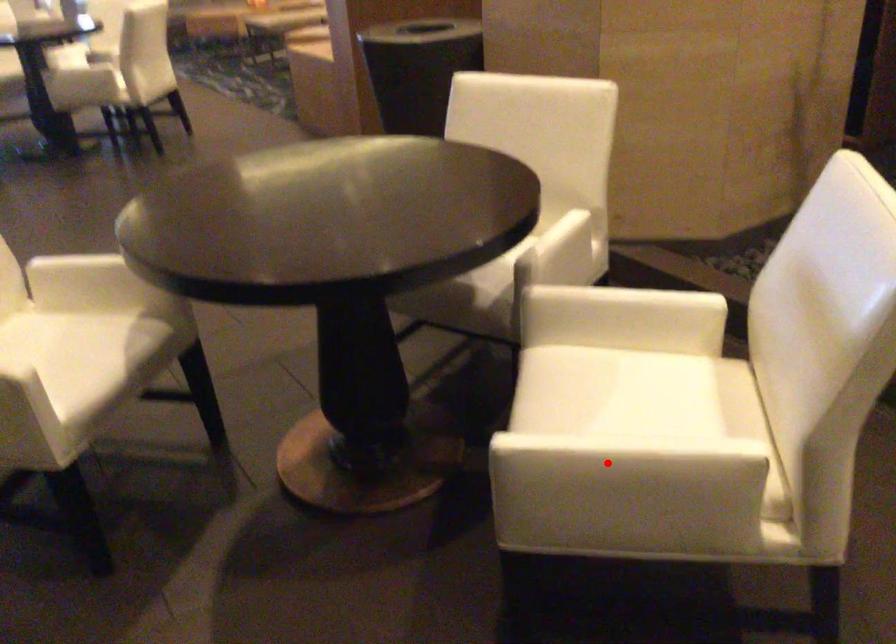
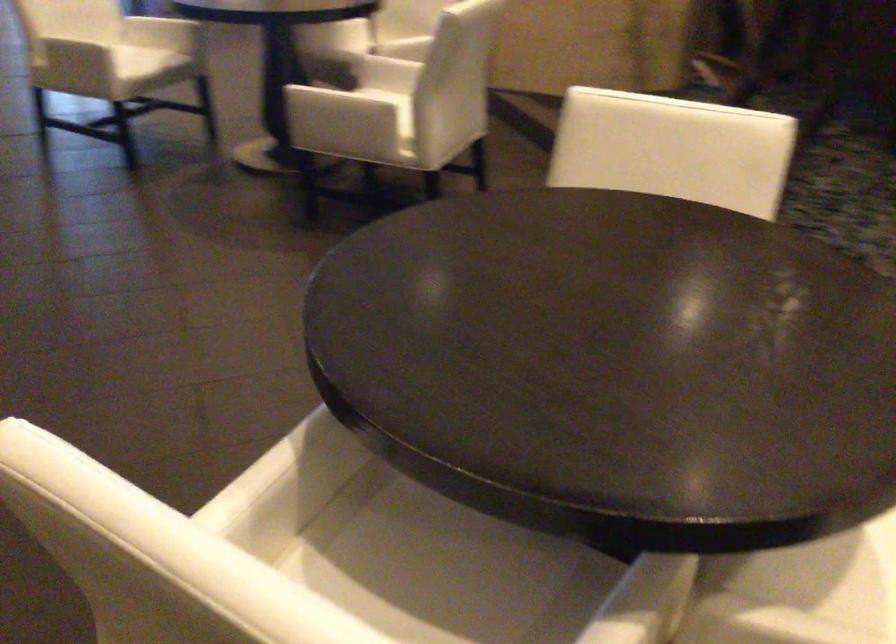
Question: I am providing you with two images of the same scene from different viewpoints. A red point is marked on the first image. At the location where the point appears in image 1, is it still visible in image 2?

Choices:
 (A) Yes
 (B) No

Answer: (B)